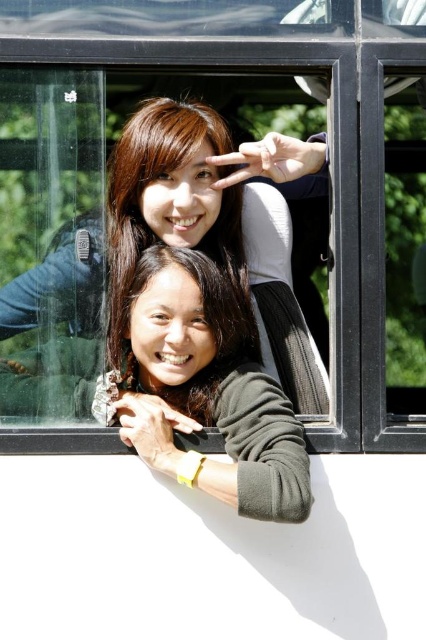
Question: Which object is the closest to the matte black sweater at upper center?

Choices:
 (A) dark green sweater at center
 (B) matte green sweater at center

Answer: (B)

Question: Which object appears farthest from the camera in this image?

Choices:
 (A) matte green sweater at center
 (B) matte black sweater at upper center

Answer: (A)

Question: Among these objects, which one is nearest to the camera?

Choices:
 (A) dark green sweater at center
 (B) matte green sweater at center

Answer: (A)

Question: Is matte black sweater at upper center above matte green sweater at center?

Choices:
 (A) no
 (B) yes

Answer: (A)

Question: Does dark green sweater at center have a greater width compared to matte green sweater at center?

Choices:
 (A) no
 (B) yes

Answer: (B)

Question: Where is matte black sweater at upper center located in relation to dark green sweater at center in the image?

Choices:
 (A) above
 (B) below

Answer: (A)